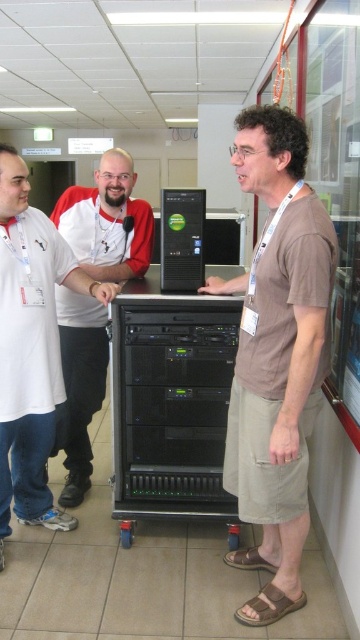
Looking at this image, you are an IT technician who needs to access the matte black server at center. There is a person wearing a brown cotton shirt at center blocking your path. Can you walk around them to reach the server?

The brown cotton shirt at center has a larger size compared to matte black server at center. Since the person is blocking your path, you may need to ask them to move aside as their larger size might make it difficult to navigate around them without causing obstruction.

You are an IT technician in the server room and need to locate two specific items for a task. You have to find the brown cotton shirt at center and the black plastic computer at center. Based on the scene description, which object is positioned to the right of the other?

The brown cotton shirt at center is to the right of the black plastic computer at center according to the description.

You are organizing a team photo and need to arrange the brown cotton shirt at center and the matte white shirt at left based on their sizes. Which shirt should be placed in the front row to ensure visibility?

The brown cotton shirt at center is larger in size than the matte white shirt at left, so placing the larger brown cotton shirt at center in the front row would ensure better visibility.